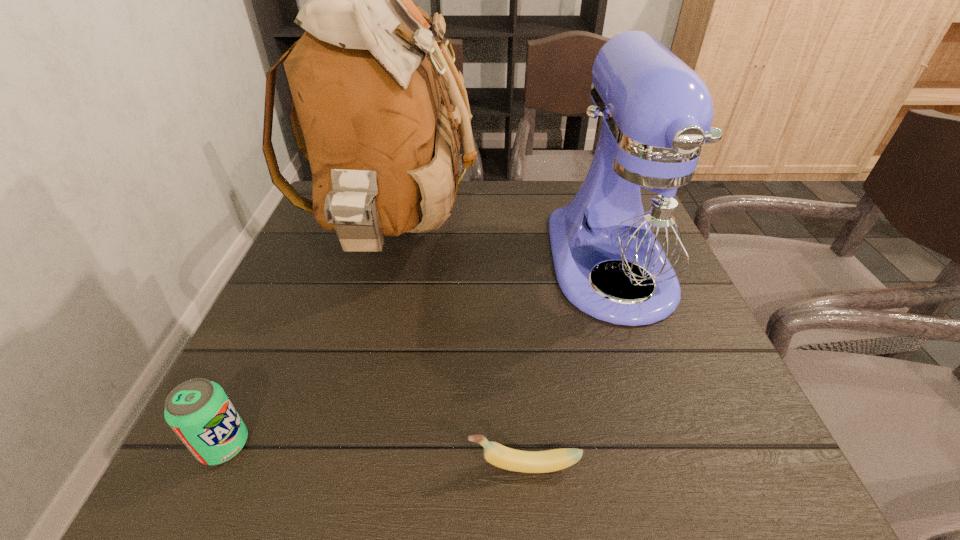
Identify the location of object that is at the far right corner. (640, 218).

Image resolution: width=960 pixels, height=540 pixels. Identify the location of free space at the far edge. (493, 205).

The image size is (960, 540). What are the coordinates of `free region at the near edge` in the screenshot? It's located at (337, 436).

The width and height of the screenshot is (960, 540). Find the location of `free space at the left edge`. free space at the left edge is located at coordinates (238, 381).

Find the location of `vacant space at the right edge`. vacant space at the right edge is located at coordinates click(x=633, y=363).

Image resolution: width=960 pixels, height=540 pixels. Find the location of `vacant space that is in between the third tallest object and the mixer`. vacant space that is in between the third tallest object and the mixer is located at coordinates (418, 354).

Where is `vacant point located between the banana and the third tallest object`? vacant point located between the banana and the third tallest object is located at coordinates (374, 455).

Image resolution: width=960 pixels, height=540 pixels. What are the coordinates of `vacant space that's between the banana and the tallest object` in the screenshot? It's located at tap(459, 350).

At what (x,y) coordinates should I click in order to perform the action: click on free spot between the second tallest object and the pop soda. Please return your answer as a coordinate pair (x, y). Looking at the image, I should click on (418, 354).

At what (x,y) coordinates should I click in order to perform the action: click on vacant space in between the shortest object and the second tallest object. Please return your answer as a coordinate pair (x, y). Looking at the image, I should click on (567, 365).